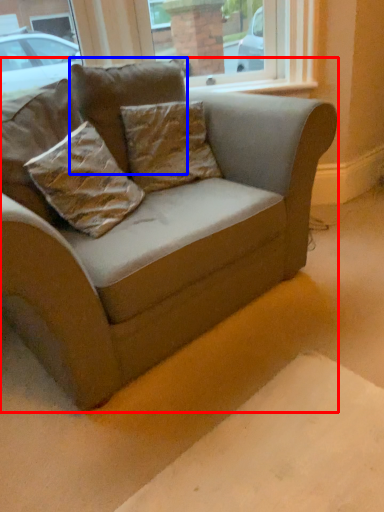
Question: Which point is closer to the camera, studio couch (highlighted by a red box) or pillow (highlighted by a blue box)?

Choices:
 (A) studio couch
 (B) pillow

Answer: (A)